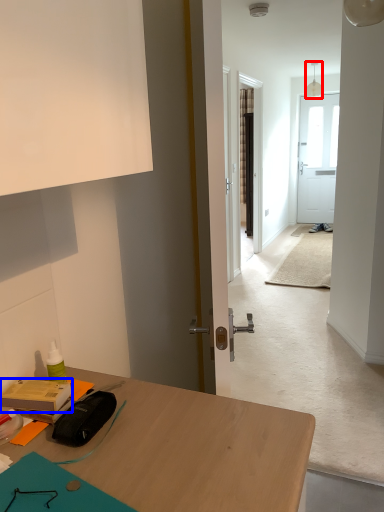
Question: Which object appears farthest to the camera in this image, lamp (highlighted by a red box) or stationery (highlighted by a blue box)?

Choices:
 (A) lamp
 (B) stationery

Answer: (A)